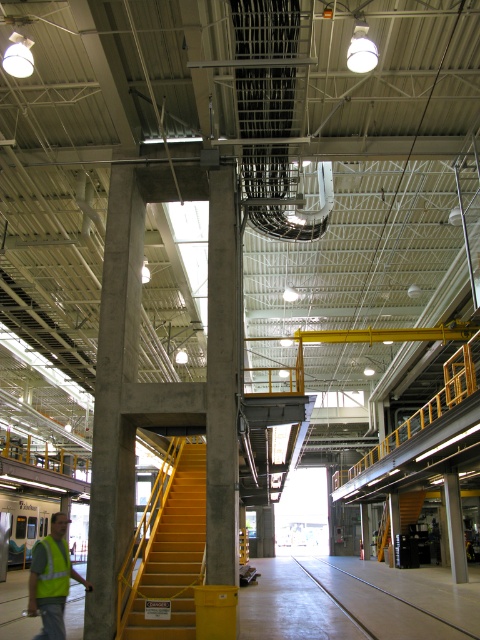
Is concrete/stucco pillar at center above yellow matte/stained stairs at center-left?

Correct, concrete/stucco pillar at center is located above yellow matte/stained stairs at center-left.

Is point (100, 296) in front of point (139, 593)?

That is False.

Is point (97, 342) positioned behind point (183, 531)?

That is False.

This screenshot has height=640, width=480. Find the location of `concrete/stucco pillar at center`. concrete/stucco pillar at center is located at coordinates (115, 401).

Between point (131, 429) and point (69, 557), which one is positioned in front?

Point (69, 557) is in front.

Can you confirm if concrete/stucco pillar at center is smaller than high visibility fabric safety vest at lower left?

No.

Locate an element on the screen. Image resolution: width=480 pixels, height=640 pixels. concrete/stucco pillar at center is located at coordinates (115, 401).

Between concrete/stucco pillar at center and reflective yellow vest at lower left, which one has more height?

concrete/stucco pillar at center is taller.

Which is above, concrete/stucco pillar at center or reflective yellow vest at lower left?

concrete/stucco pillar at center

This screenshot has width=480, height=640. What do you see at coordinates (115, 401) in the screenshot?
I see `concrete/stucco pillar at center` at bounding box center [115, 401].

Identify the location of concrete/stucco pillar at center. The image size is (480, 640). (115, 401).